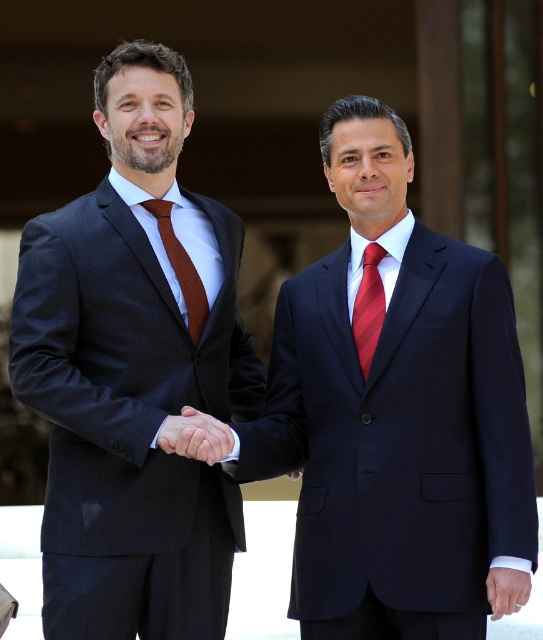
You are a photographer capturing a formal event. You notice the smooth skin handshake at center and the red striped tie at center in the scene. Which object is positioned lower in the image?

The smooth skin handshake at center is located below the red striped tie at center, so the smooth skin handshake at center is positioned lower in the image.